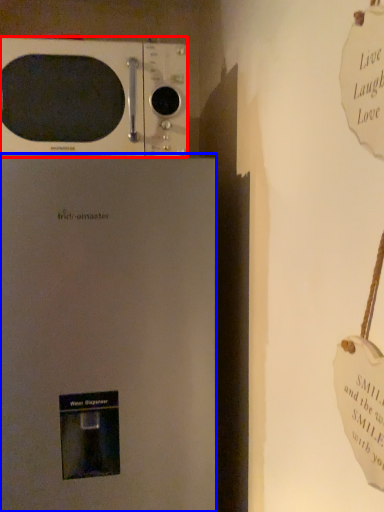
Question: Which object is closer to the camera taking this photo, microwave oven (highlighted by a red box) or refrigerator (highlighted by a blue box)?

Choices:
 (A) microwave oven
 (B) refrigerator

Answer: (B)